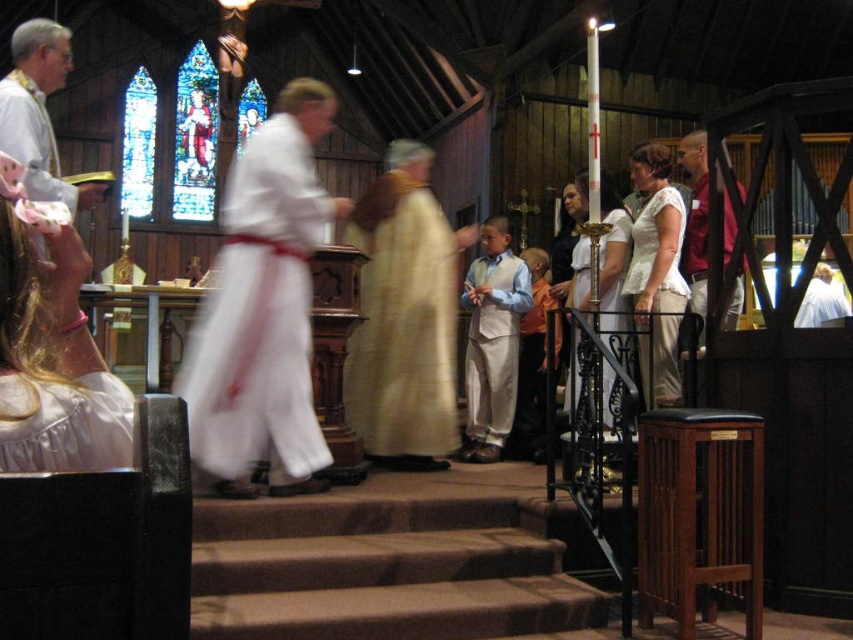
Question: Considering the relative positions of white silk robe at upper left and matte white dress at center in the image provided, where is white silk robe at upper left located with respect to matte white dress at center?

Choices:
 (A) above
 (B) below

Answer: (A)

Question: Which of the following is the farthest from the observer?

Choices:
 (A) (265, 360)
 (B) (103, 413)
 (C) (39, 160)

Answer: (C)

Question: Considering the real-world distances, which object is farthest from the light gray fabric vest at center?

Choices:
 (A) white satin robe at lower left
 (B) white matte robe at center
 (C) white clothed figure at center

Answer: (A)

Question: Is white clothed figure at center positioned behind matte white dress at center?

Choices:
 (A) yes
 (B) no

Answer: (B)

Question: Which point appears farthest from the camera in this image?

Choices:
 (A) (4, 467)
 (B) (627, 236)
 (C) (508, 246)

Answer: (C)

Question: Can you confirm if white silk robe at upper left is wider than maroon fabric shirt at right?

Choices:
 (A) no
 (B) yes

Answer: (A)